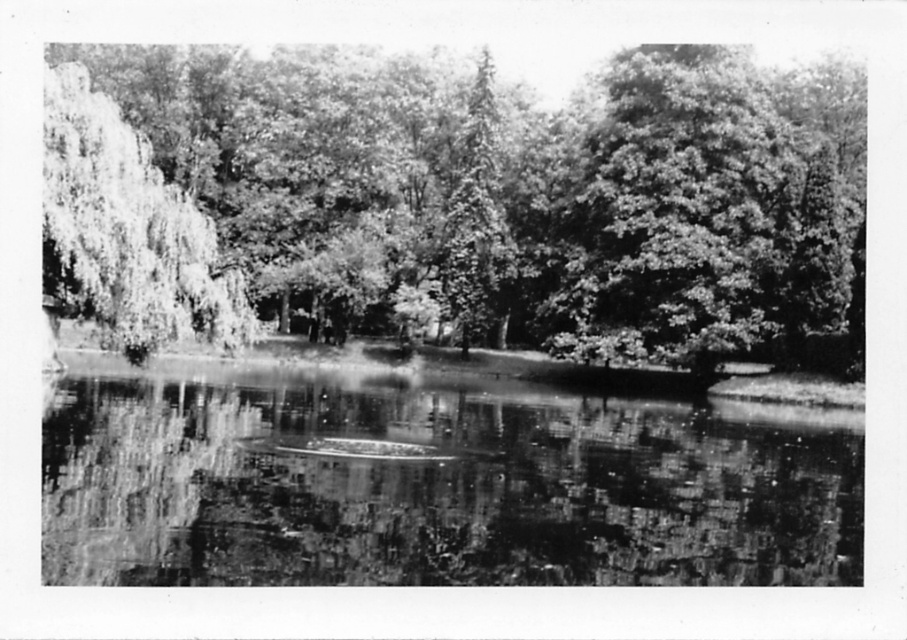
Question: Among these objects, which one is farthest from the camera?

Choices:
 (A) smooth reflective water at center
 (B) smooth green tree at upper left

Answer: (B)

Question: Is smooth green tree at upper left to the right of grayscale leafy tree at left from the viewer's perspective?

Choices:
 (A) no
 (B) yes

Answer: (B)

Question: Considering the relative positions of smooth green tree at upper left and grayscale leafy tree at left in the image provided, where is smooth green tree at upper left located with respect to grayscale leafy tree at left?

Choices:
 (A) below
 (B) above

Answer: (B)

Question: Among these points, which one is nearest to the camera?

Choices:
 (A) (396, 547)
 (B) (584, 275)

Answer: (A)

Question: Which of the following is the closest to the observer?

Choices:
 (A) (69, 97)
 (B) (211, 125)
 (C) (203, 481)

Answer: (C)

Question: Is smooth green tree at upper left below smooth reflective water at center?

Choices:
 (A) no
 (B) yes

Answer: (A)